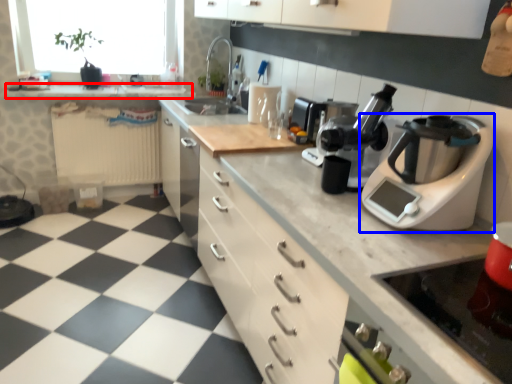
Question: Which of the following is the farthest to the observer, counter top (highlighted by a red box) or home appliance (highlighted by a blue box)?

Choices:
 (A) counter top
 (B) home appliance

Answer: (A)